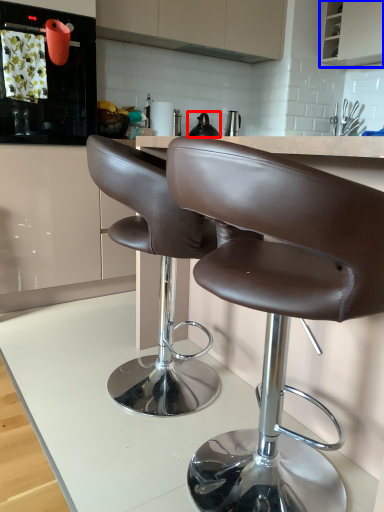
Question: Which object is further to the camera taking this photo, tea pot (highlighted by a red box) or cabinetry (highlighted by a blue box)?

Choices:
 (A) tea pot
 (B) cabinetry

Answer: (B)